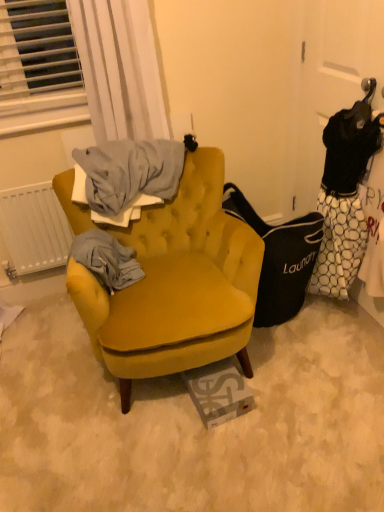
Question: Does white sheer curtain at upper left have a greater height compared to white matte radiator at left?

Choices:
 (A) yes
 (B) no

Answer: (A)

Question: Is white sheer curtain at upper left behind white matte radiator at left?

Choices:
 (A) yes
 (B) no

Answer: (B)

Question: Is white sheer curtain at upper left not near white matte radiator at left?

Choices:
 (A) no
 (B) yes

Answer: (A)

Question: Considering the relative positions of white sheer curtain at upper left and white matte radiator at left in the image provided, is white sheer curtain at upper left to the right of white matte radiator at left from the viewer's perspective?

Choices:
 (A) yes
 (B) no

Answer: (A)

Question: Does white sheer curtain at upper left have a lesser width compared to white matte radiator at left?

Choices:
 (A) no
 (B) yes

Answer: (A)

Question: Does point (34, 232) appear closer or farther from the camera than point (139, 373)?

Choices:
 (A) farther
 (B) closer

Answer: (A)

Question: Considering the positions of white matte radiator at left and velvet mustard armchair at center in the image, is white matte radiator at left bigger or smaller than velvet mustard armchair at center?

Choices:
 (A) big
 (B) small

Answer: (B)

Question: Is white matte radiator at left taller or shorter than velvet mustard armchair at center?

Choices:
 (A) short
 (B) tall

Answer: (A)

Question: From a real-world perspective, is white matte radiator at left physically located above or below velvet mustard armchair at center?

Choices:
 (A) below
 (B) above

Answer: (B)

Question: Is white matte radiator at left to the left or to the right of white sheer curtain at upper left in the image?

Choices:
 (A) right
 (B) left

Answer: (B)

Question: Considering their positions, is white matte radiator at left located in front of or behind white sheer curtain at upper left?

Choices:
 (A) front
 (B) behind

Answer: (B)

Question: From the image's perspective, is white matte radiator at left positioned above or below white sheer curtain at upper left?

Choices:
 (A) above
 (B) below

Answer: (B)

Question: Looking at the image, does white matte radiator at left seem bigger or smaller compared to white sheer curtain at upper left?

Choices:
 (A) big
 (B) small

Answer: (B)

Question: Is velvet mustard armchair at center situated inside white matte radiator at left or outside?

Choices:
 (A) outside
 (B) inside

Answer: (A)

Question: In the image, is velvet mustard armchair at center positioned in front of or behind white matte radiator at left?

Choices:
 (A) front
 (B) behind

Answer: (A)